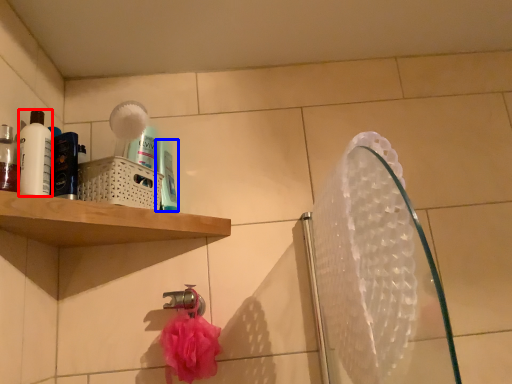
Question: Which object appears closest to the camera in this image, mouthwash (highlighted by a red box) or mouthwash (highlighted by a blue box)?

Choices:
 (A) mouthwash
 (B) mouthwash

Answer: (A)